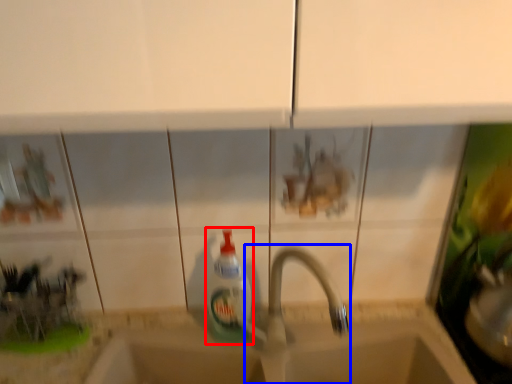
Question: Which object appears closest to the camera in this image, bottle (highlighted by a red box) or tap (highlighted by a blue box)?

Choices:
 (A) bottle
 (B) tap

Answer: (B)